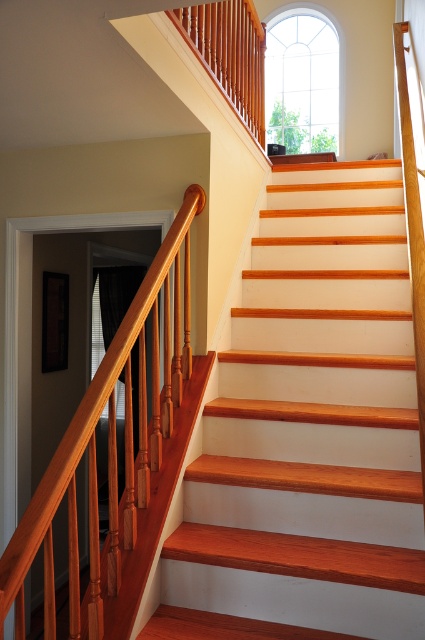
Question: Is wooden stair at upper center to the left of wooden balustrade at upper center from the viewer's perspective?

Choices:
 (A) no
 (B) yes

Answer: (A)

Question: Can you confirm if wooden stair at upper center is thinner than polished wood handrail at left?

Choices:
 (A) yes
 (B) no

Answer: (B)

Question: Which of the following is the closest to the observer?

Choices:
 (A) (422, 540)
 (B) (212, 77)
 (C) (68, 492)

Answer: (C)

Question: Among these points, which one is farthest from the camera?

Choices:
 (A) (243, 428)
 (B) (229, 68)

Answer: (B)

Question: Which point is closer to the camera taking this photo?

Choices:
 (A) (306, 525)
 (B) (76, 426)
 (C) (201, 28)

Answer: (B)

Question: Does wooden stair at upper center appear on the left side of wooden balustrade at upper center?

Choices:
 (A) yes
 (B) no

Answer: (B)